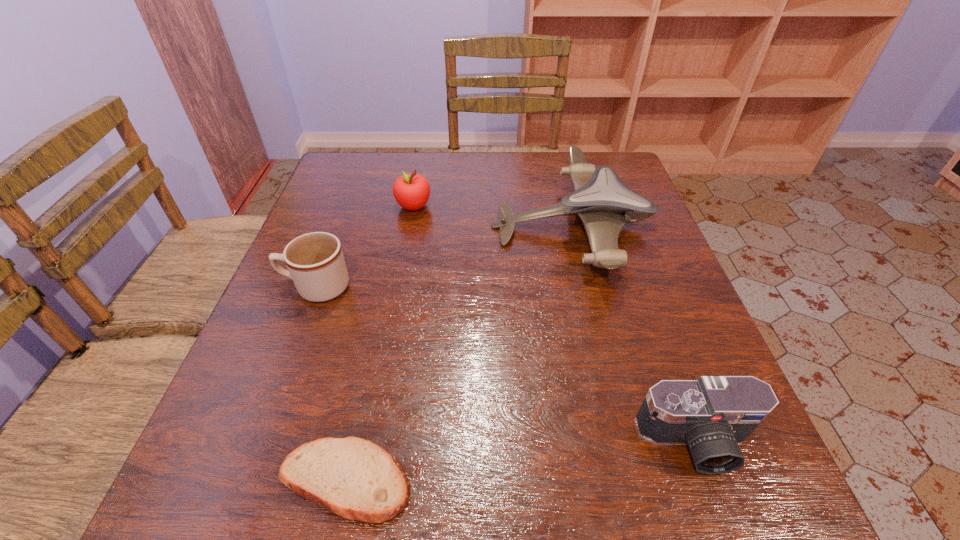
Where is `apple that is at the far edge`? This screenshot has width=960, height=540. apple that is at the far edge is located at coordinates (411, 191).

This screenshot has width=960, height=540. Find the location of `drone that is at the far edge`. drone that is at the far edge is located at coordinates (603, 202).

Locate an element on the screen. Image resolution: width=960 pixels, height=540 pixels. camera present at the near edge is located at coordinates point(713,414).

Locate an element on the screen. The image size is (960, 540). pita bread positioned at the near edge is located at coordinates (352, 477).

In order to click on mug that is at the left edge in this screenshot , I will do `click(315, 261)`.

Locate an element on the screen. pita bread that is at the left edge is located at coordinates (352, 477).

Where is `drone that is positioned at the right edge`? This screenshot has width=960, height=540. drone that is positioned at the right edge is located at coordinates (603, 202).

Find the location of a particular element. camera present at the right edge is located at coordinates (713, 414).

Where is `object located at the near left corner`? object located at the near left corner is located at coordinates (352, 477).

Identify the location of object that is at the far right corner. Image resolution: width=960 pixels, height=540 pixels. (603, 202).